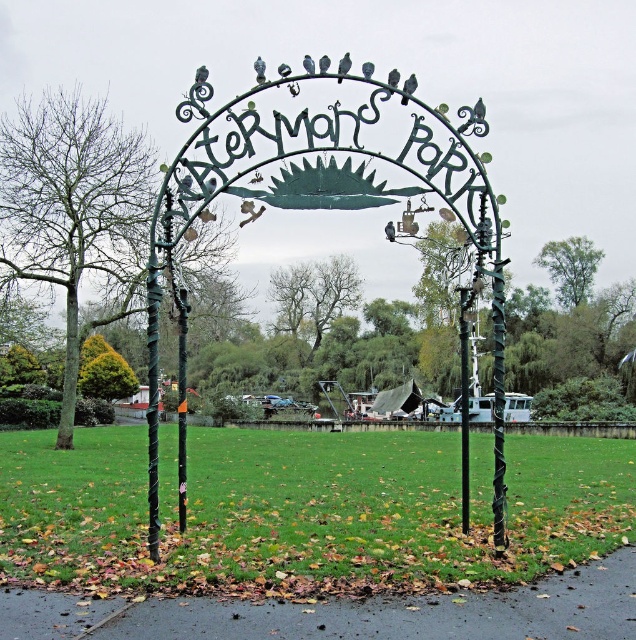
Looking at this image, is green wrought iron pole at center wider than gray matte bird at upper center?

Indeed, green wrought iron pole at center has a greater width compared to gray matte bird at upper center.

Who is positioned more to the right, green wrought iron pole at center or gray matte bird at upper center?

green wrought iron pole at center

Does point (497, 403) lie behind point (411, 92)?

No, (497, 403) is in front of (411, 92).

You are a GUI agent. You are given a task and a screenshot of the screen. Output one action in this format:
    pyautogui.click(x=<x>, y=<y>)
    Task: Click on the green wrought iron pole at center
    
    Given the screenshot: What is the action you would take?
    pos(499,396)

Can you confirm if green wrought iron pole at center is bigger than black metal pole at center?

Yes.

Which is above, green wrought iron pole at center or black metal pole at center?

black metal pole at center is higher up.

Which is in front, point (497, 300) or point (177, 429)?

Positioned in front is point (497, 300).

Identify the location of green wrought iron pole at center. The image size is (636, 640). (499, 396).

At what (x,y) coordinates should I click in order to perform the action: click on black metal pole at center. Please return your answer as a coordinate pair (x, y). The height and width of the screenshot is (640, 636). Looking at the image, I should click on (181, 404).

Between point (181, 301) and point (474, 104), which one is positioned behind?

The point (181, 301) is behind.

This screenshot has height=640, width=636. Find the location of `black metal pole at center`. black metal pole at center is located at coordinates (181, 404).